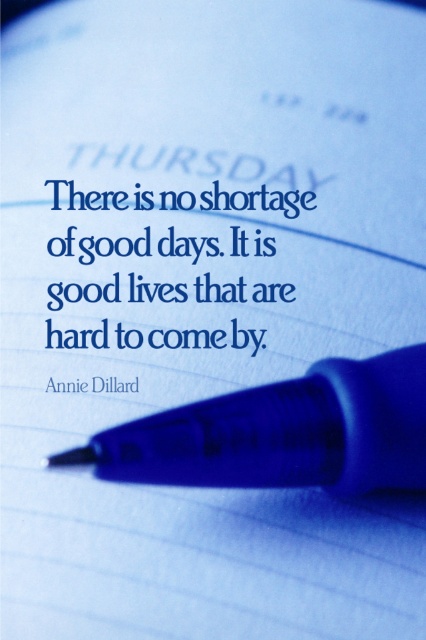
Question: Which of the following is the closest to the observer?

Choices:
 (A) 287,397
 (B) 135,198

Answer: (A)

Question: Is blue paper at center positioned at the back of blue plastic pen at center?

Choices:
 (A) yes
 (B) no

Answer: (A)

Question: Which point is closer to the camera?

Choices:
 (A) blue paper at center
 (B) blue plastic pen at center

Answer: (B)

Question: Which point appears closest to the camera in this image?

Choices:
 (A) (226, 413)
 (B) (215, 192)

Answer: (A)

Question: Is blue paper at center further to camera compared to blue plastic pen at center?

Choices:
 (A) no
 (B) yes

Answer: (B)

Question: Is blue paper at center to the right of blue plastic pen at center from the viewer's perspective?

Choices:
 (A) yes
 (B) no

Answer: (B)